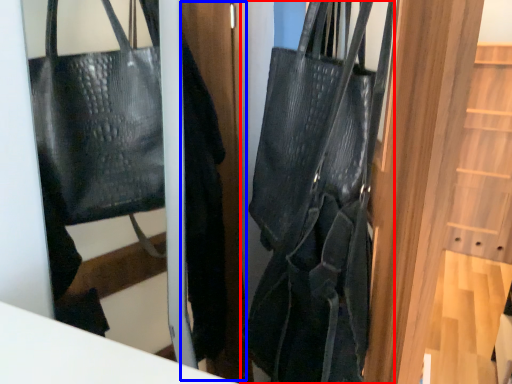
Question: Among these objects, which one is nearest to the camera, handbag (highlighted by a red box) or door (highlighted by a blue box)?

Choices:
 (A) handbag
 (B) door

Answer: (A)